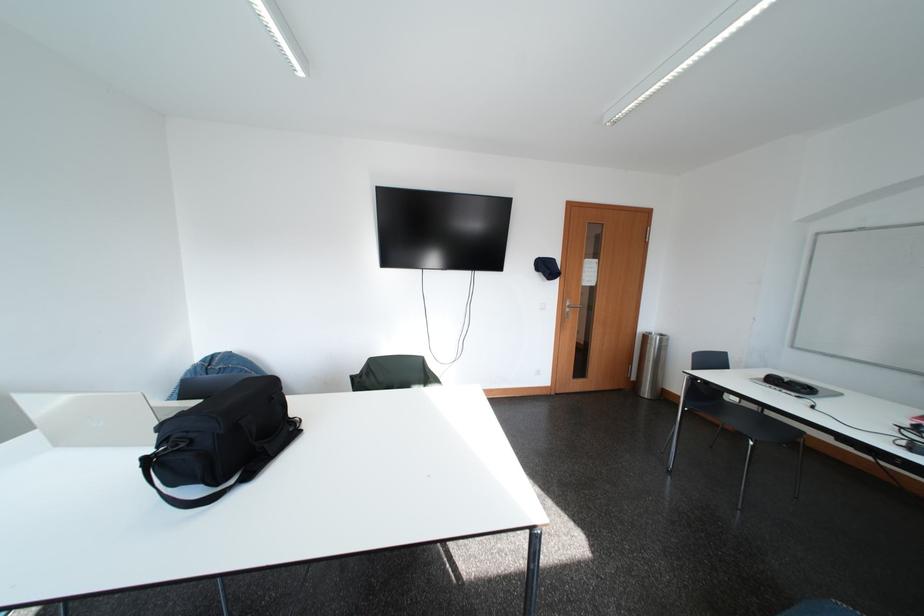
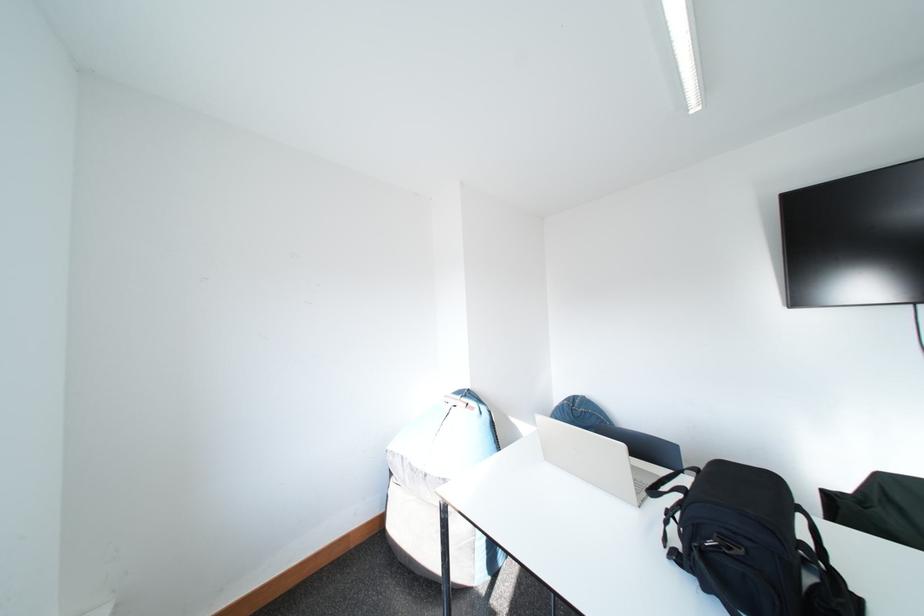
Question: The images are taken continuously from a first-person perspective. In which direction is your viewpoint rotating?

Choices:
 (A) Left
 (B) Right
 (C) Up
 (D) Down

Answer: (A)